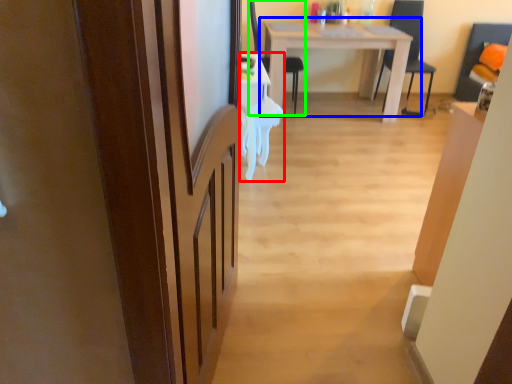
Question: Considering the real-world distances, which object is farthest from desk (highlighted by a red box)? table (highlighted by a blue box) or chair (highlighted by a green box)?

Choices:
 (A) table
 (B) chair

Answer: (A)